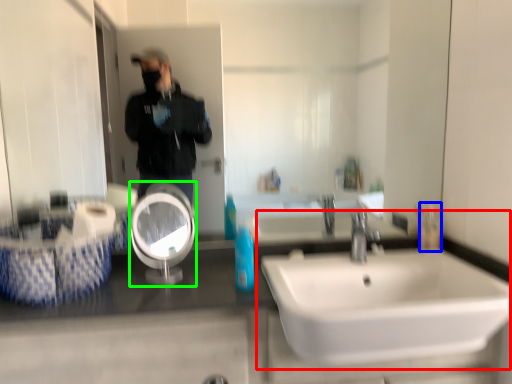
Question: Based on their relative distances, which object is nearer to sink (highlighted by a red box)? Choose from mouthwash (highlighted by a blue box) and reflection (highlighted by a green box).

Choices:
 (A) mouthwash
 (B) reflection

Answer: (A)